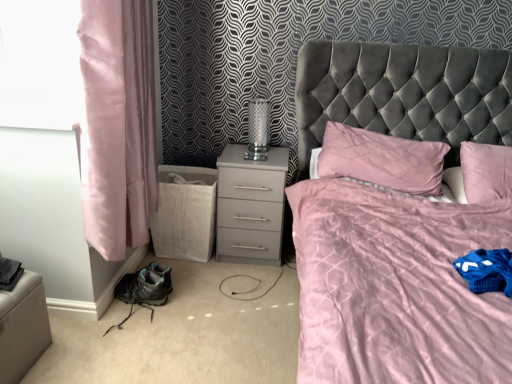
Question: Looking at their shapes, would you say pink satin curtain at left is wider or thinner than clear glass table lamp at center?

Choices:
 (A) thin
 (B) wide

Answer: (B)

Question: In the image, is pink satin curtain at left on the left side or the right side of clear glass table lamp at center?

Choices:
 (A) right
 (B) left

Answer: (B)

Question: Which is farther from the velvet grey bed at center?

Choices:
 (A) matte gray nightstand at center
 (B) pink satin pillow at center
 (C) pink satin curtain at left
 (D) clear glass table lamp at center

Answer: (C)

Question: Which object is positioned farthest from the velvet grey bed at center?

Choices:
 (A) pink satin curtain at left
 (B) pink satin pillow at center
 (C) matte gray nightstand at center
 (D) clear glass table lamp at center

Answer: (A)